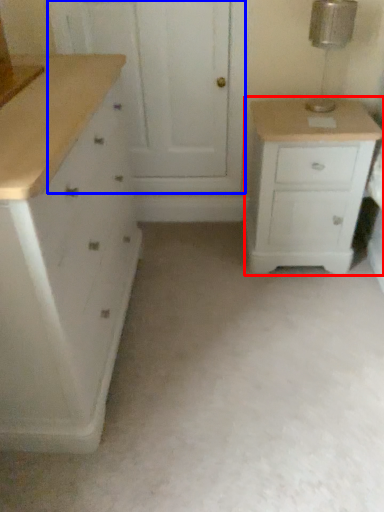
Question: Which object appears closest to the camera in this image, chest of drawers (highlighted by a red box) or screen door (highlighted by a blue box)?

Choices:
 (A) chest of drawers
 (B) screen door

Answer: (A)